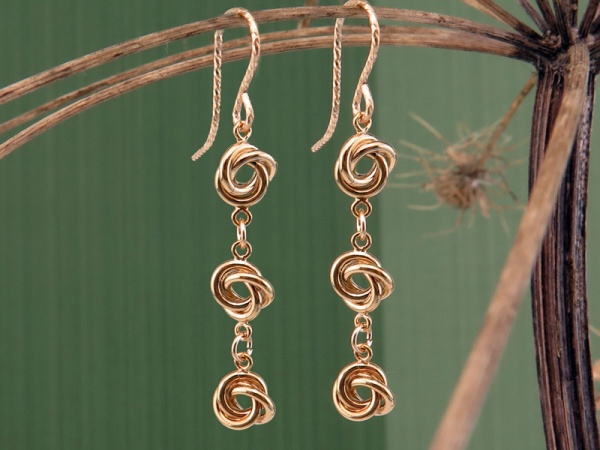
Where is `hook`? The width and height of the screenshot is (600, 450). hook is located at coordinates (258, 28), (380, 31).